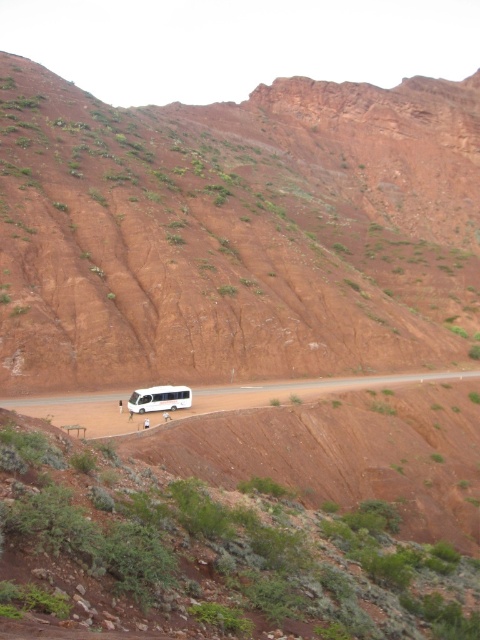
Consider the image. You are a tour guide planning to drive a new tour bus that is 2.5 meters wide. You need to navigate the white matte dirt track at center where the white matte tour bus at center is currently parked. Can your new bus safely pass through the track?

The white matte dirt track at center is wider than the white matte tour bus at center, so the new bus that is 2.5 meters wide can safely pass through the track as long as the track width accommodates the bus width. However, the exact width of the track isn